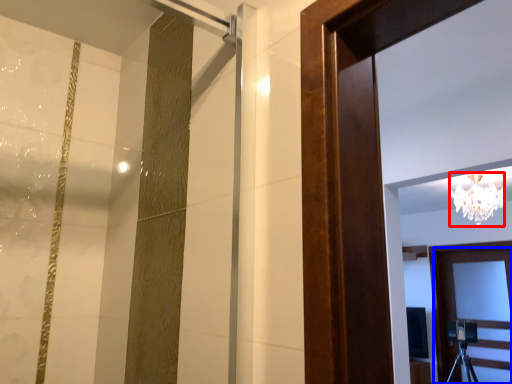
Question: Which point is further to the camera, lamp (highlighted by a red box) or door (highlighted by a blue box)?

Choices:
 (A) lamp
 (B) door

Answer: (B)